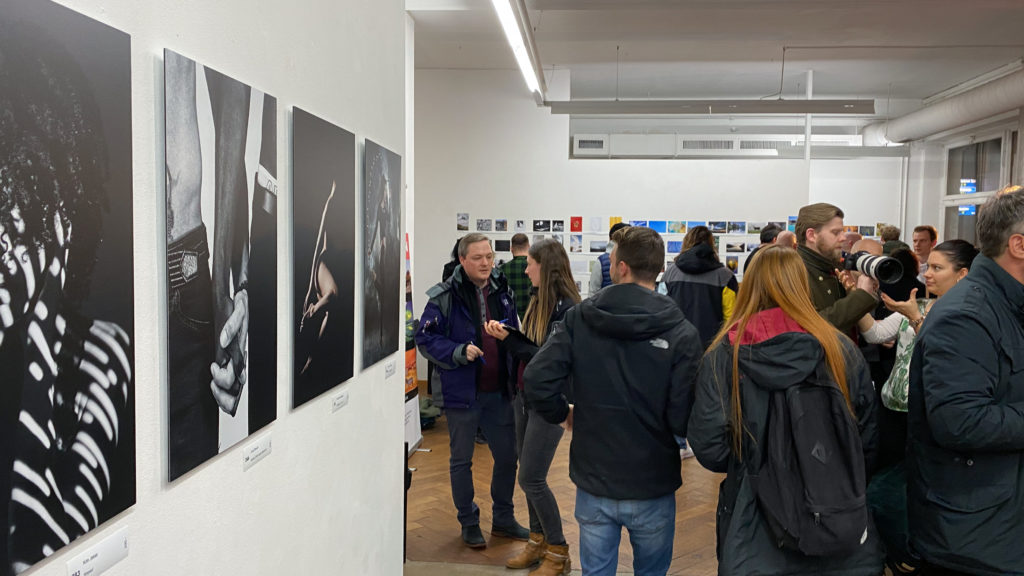
Find the location of a particular element. hardwood floor is located at coordinates (440, 473), (696, 511), (557, 467).